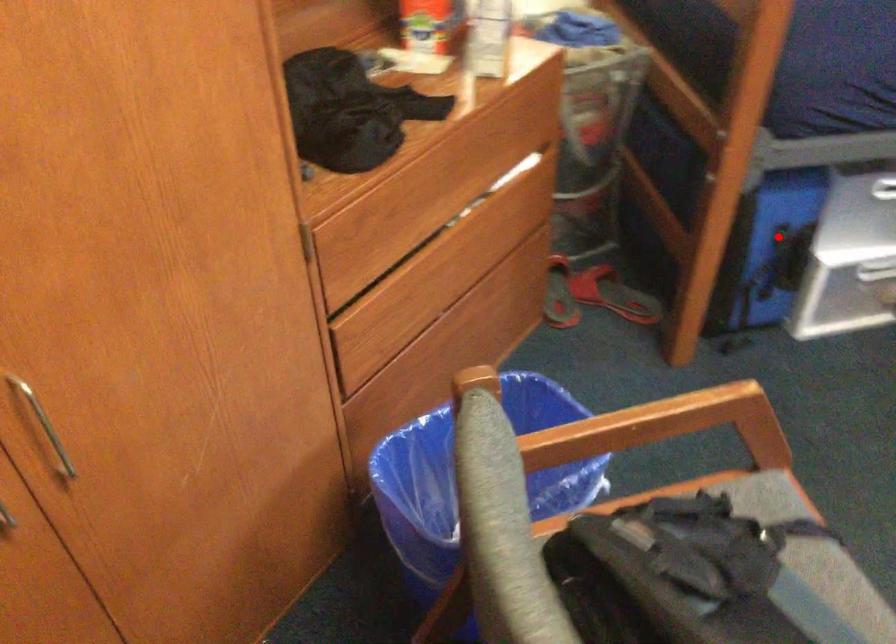
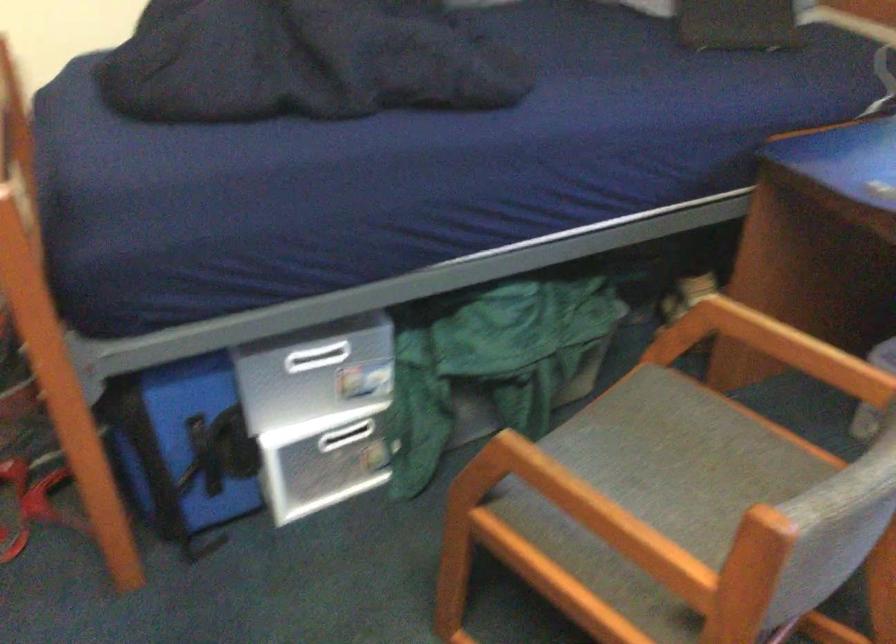
Where in the second image is the point corresponding to the highlighted location from the first image?

(200, 428)